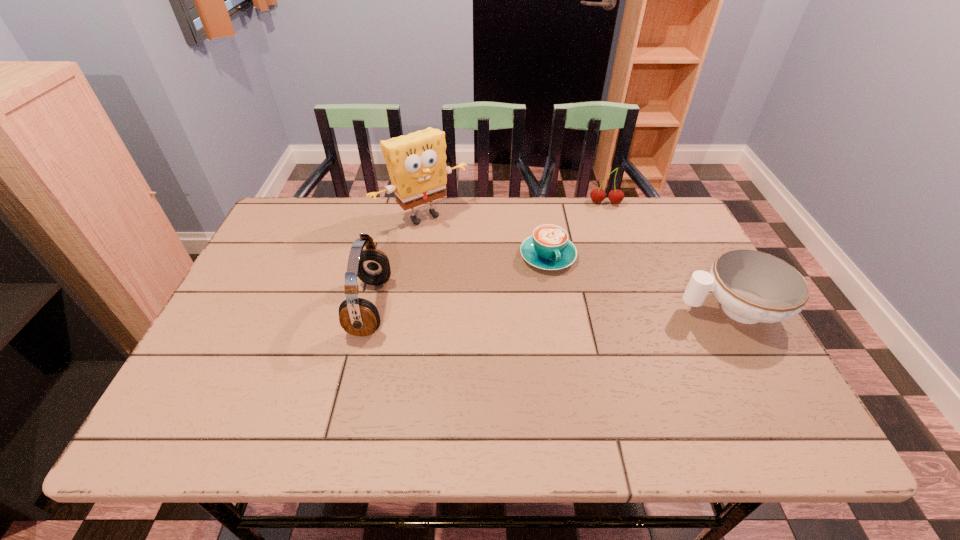
The height and width of the screenshot is (540, 960). I want to click on free spot between the sponge and the third object from right to left, so click(486, 237).

Where is `vacant space that is in between the sponge and the headset`? The image size is (960, 540). vacant space that is in between the sponge and the headset is located at coordinates (396, 261).

At what (x,y) coordinates should I click in order to perform the action: click on free space that is in between the fourth object from left to right and the third farthest object. Please return your answer as a coordinate pair (x, y). This screenshot has width=960, height=540. Looking at the image, I should click on (577, 230).

Find the location of a particular element. The height and width of the screenshot is (540, 960). free spot between the sponge and the rightmost object is located at coordinates (577, 263).

Image resolution: width=960 pixels, height=540 pixels. Identify the location of free space between the second tallest object and the cherry. (488, 255).

Locate an element on the screen. The width and height of the screenshot is (960, 540). vacant space that is in between the shortest object and the chinaware is located at coordinates (639, 283).

Locate an element on the screen. unoccupied area between the headset and the tallest object is located at coordinates (396, 261).

You are a GUI agent. You are given a task and a screenshot of the screen. Output one action in this format:
    pyautogui.click(x=<x>, y=<y>)
    Task: Click on the third closest object to the shortest object
    Image resolution: width=960 pixels, height=540 pixels.
    Given the screenshot: What is the action you would take?
    pyautogui.click(x=752, y=286)

Locate which object is the second closest to the third object from right to left. Please provide its 2D coordinates. Your answer should be formatted as a tuple, i.e. [(x, y)], where the tuple contains the x and y coordinates of a point satisfying the conditions above.

[(597, 195)]

I want to click on free spot that satisfies the following two spatial constraints: 1. on the back side of the tallest object; 2. on the left side of the second object from right to left, so click(425, 203).